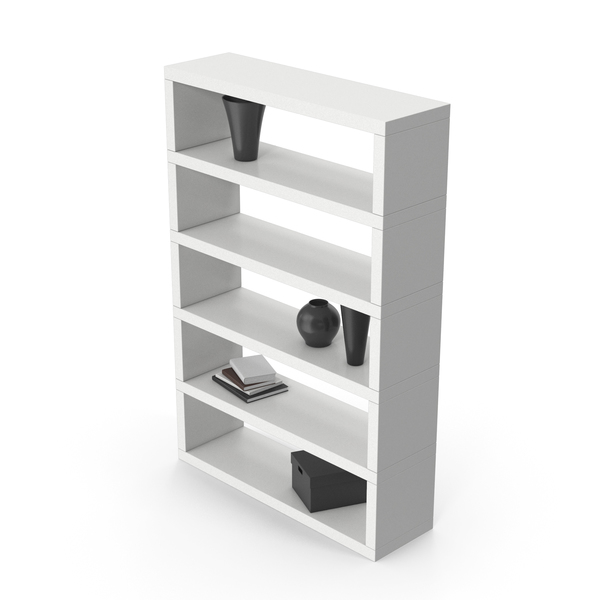
I want to click on small round black vase, so click(325, 326).